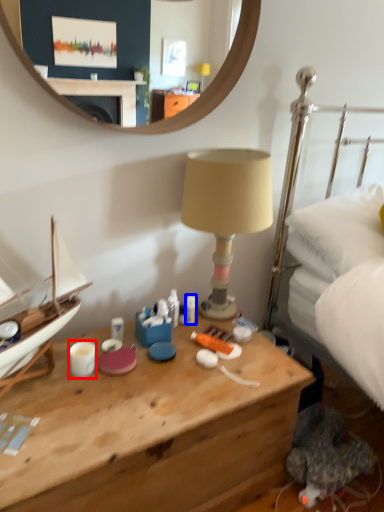
Question: Among these objects, which one is nearest to the camera, coffee cup (highlighted by a red box) or toiletry (highlighted by a blue box)?

Choices:
 (A) coffee cup
 (B) toiletry

Answer: (A)